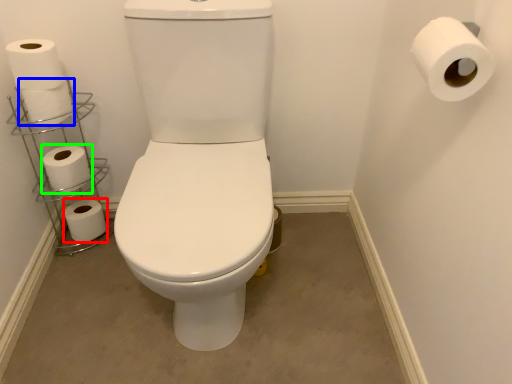
Question: Which object is positioned closest to toilet paper (highlighted by a red box)? Select from toilet paper (highlighted by a blue box) and toilet paper (highlighted by a green box).

Choices:
 (A) toilet paper
 (B) toilet paper

Answer: (B)